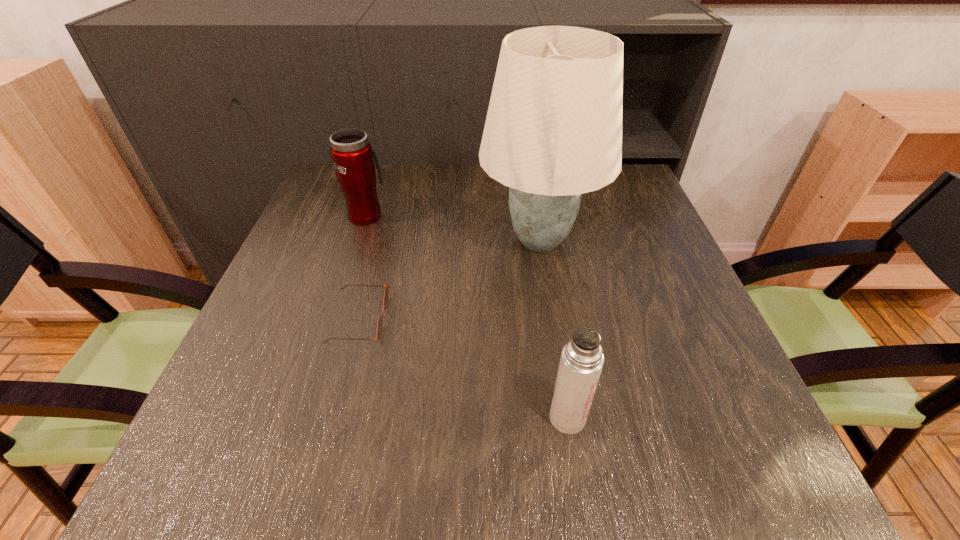
I want to click on free space between the left thermos bottle and the right thermos bottle, so click(x=468, y=316).

What are the coordinates of `vacant point located between the left thermos bottle and the shortest object` in the screenshot? It's located at (363, 267).

In order to click on empty space between the lampshade and the right thermos bottle in this screenshot , I will do `click(554, 329)`.

Locate an element on the screen. This screenshot has height=540, width=960. the third closest object to the nearer thermos bottle is located at coordinates (352, 154).

This screenshot has width=960, height=540. I want to click on object that ranks as the third closest to the shortest object, so click(581, 362).

Image resolution: width=960 pixels, height=540 pixels. I want to click on free point that satisfies the following two spatial constraints: 1. on the front side of the lampshade; 2. on the face of the shortest object, so click(x=553, y=319).

Find the location of `vacant space that satisfies the following two spatial constraints: 1. on the face of the sunglasses; 2. on the left side of the nearest object`. vacant space that satisfies the following two spatial constraints: 1. on the face of the sunglasses; 2. on the left side of the nearest object is located at coordinates (333, 418).

Find the location of a particular element. This screenshot has height=540, width=960. vacant space that satisfies the following two spatial constraints: 1. on the back side of the lampshade; 2. on the right side of the nearest object is located at coordinates (540, 240).

The height and width of the screenshot is (540, 960). I want to click on vacant area in the image that satisfies the following two spatial constraints: 1. on the face of the shortest object; 2. on the left side of the right thermos bottle, so click(333, 418).